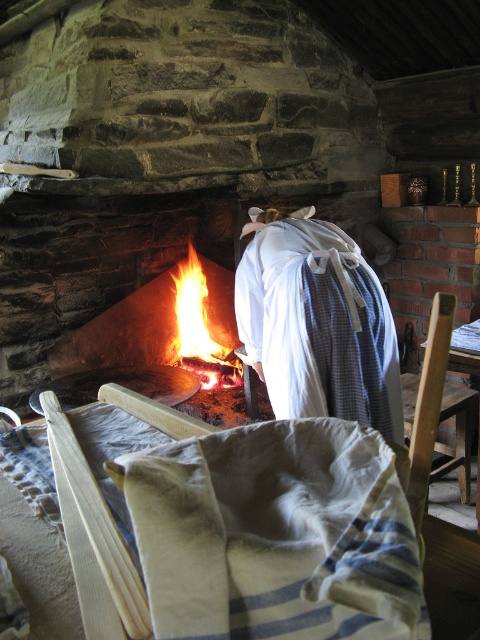
Question: Does white cotton cloth at center have a larger size compared to wooden chair at lower right?

Choices:
 (A) no
 (B) yes

Answer: (A)

Question: Considering the relative positions of white cotton apron at center and flaming wood fire at center in the image provided, where is white cotton apron at center located with respect to flaming wood fire at center?

Choices:
 (A) below
 (B) above

Answer: (A)

Question: Which object is the closest to the white cotton apron at center?

Choices:
 (A) white cotton cloth at center
 (B) wooden chair at lower right

Answer: (B)

Question: Based on their relative distances, which object is nearer to the flaming wood fire at center?

Choices:
 (A) white cotton apron at center
 (B) white cotton cloth at center
 (C) wooden chair at lower right

Answer: (C)

Question: Does white cotton cloth at center come in front of white cotton apron at center?

Choices:
 (A) no
 (B) yes

Answer: (B)

Question: Which of the following is the farthest from the observer?

Choices:
 (A) white cotton cloth at center
 (B) flaming wood fire at center
 (C) wooden chair at lower right
 (D) white cotton apron at center

Answer: (B)